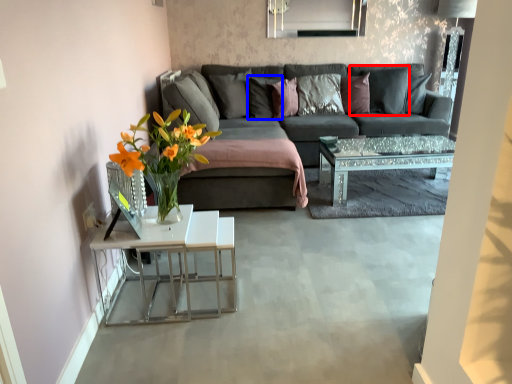
Question: Which point is closer to the camera, pillow (highlighted by a red box) or pillow (highlighted by a blue box)?

Choices:
 (A) pillow
 (B) pillow

Answer: (A)